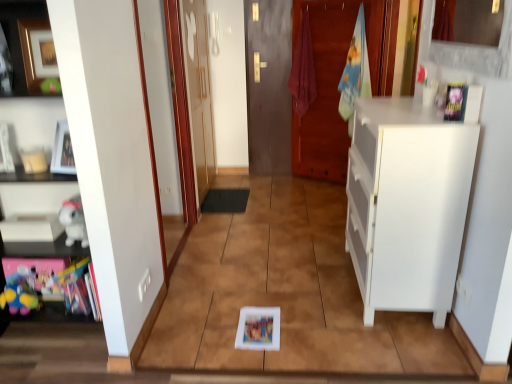
You are a GUI agent. You are given a task and a screenshot of the screen. Output one action in this format:
    pyautogui.click(x=<x>, y=<y>)
    Task: Click on the vacant region in front of white matte cabinet at left, marked as the 2th cabinetry in a right-to-left arrangement
    
    Given the screenshot: What is the action you would take?
    pyautogui.click(x=51, y=357)